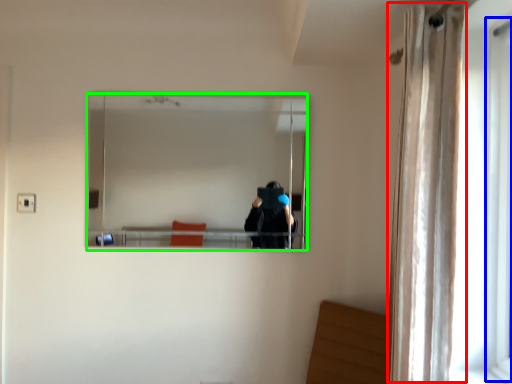
Question: Considering the real-world distances, which object is closest to curtain (highlighted by a red box)? screen door (highlighted by a blue box) or mirror (highlighted by a green box).

Choices:
 (A) screen door
 (B) mirror

Answer: (A)